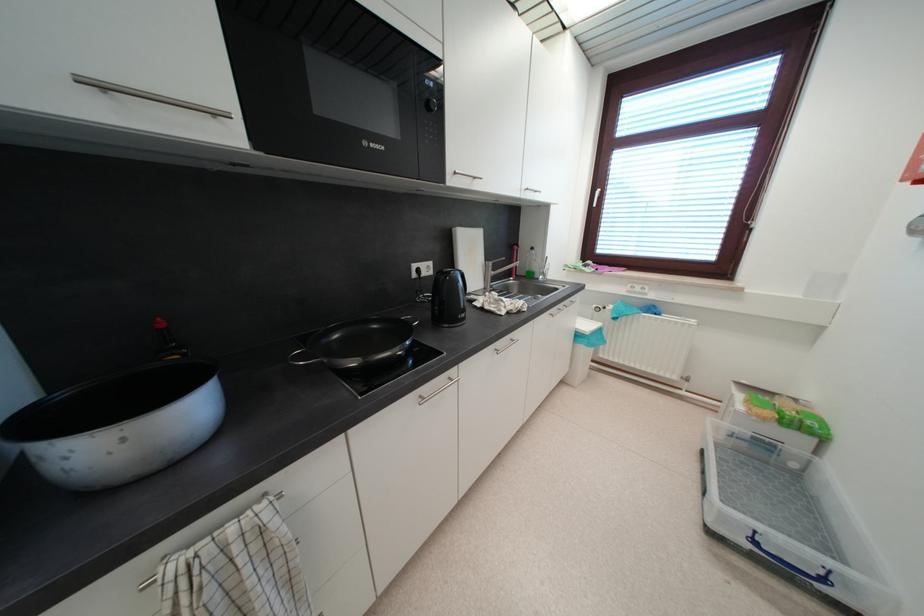
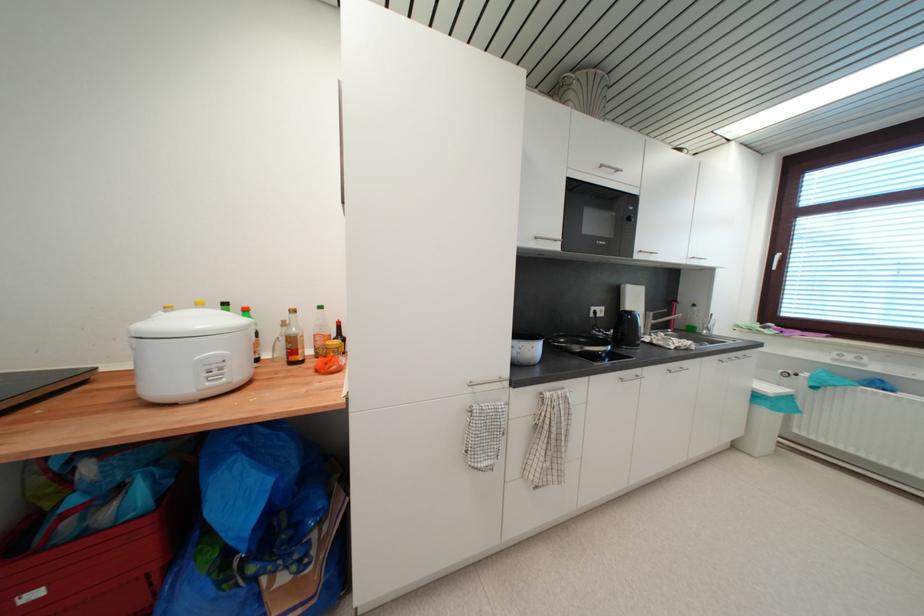
The images are taken continuously from a first-person perspective. In which direction are you moving?

The cameraman moved toward left, backward.